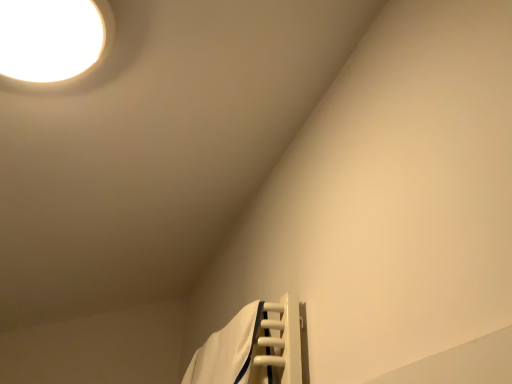
Describe the element at coordinates (227, 350) in the screenshot. I see `white fabric bath towel at lower right` at that location.

The height and width of the screenshot is (384, 512). Identify the location of white fabric bath towel at lower right. (227, 350).

What do you see at coordinates (53, 38) in the screenshot? I see `white glossy light fixture at upper left` at bounding box center [53, 38].

Measure the distance between white glossy light fixture at upper left and camera.

white glossy light fixture at upper left and camera are 28.39 inches apart from each other.

This screenshot has height=384, width=512. What are the coordinates of `white glossy light fixture at upper left` in the screenshot? It's located at (53, 38).

I want to click on white fabric bath towel at lower right, so click(227, 350).

Considering the positions of objects white fabric bath towel at lower right and white glossy light fixture at upper left in the image provided, who is more to the right, white fabric bath towel at lower right or white glossy light fixture at upper left?

From the viewer's perspective, white fabric bath towel at lower right appears more on the right side.

Is white fabric bath towel at lower right positioned in front of white glossy light fixture at upper left?

No, white fabric bath towel at lower right is behind white glossy light fixture at upper left.

Does point (252, 308) appear closer or farther from the camera than point (5, 30)?

Point (252, 308) is farther from the camera than point (5, 30).

From the image's perspective, who appears lower, white fabric bath towel at lower right or white glossy light fixture at upper left?

white fabric bath towel at lower right appears lower in the image.

From a real-world perspective, which object stands above the other?

In real-world perspective, white glossy light fixture at upper left is above.

Which object is thinner, white fabric bath towel at lower right or white glossy light fixture at upper left?

white fabric bath towel at lower right is thinner.

Can you confirm if white fabric bath towel at lower right is taller than white glossy light fixture at upper left?

Indeed, white fabric bath towel at lower right has a greater height compared to white glossy light fixture at upper left.

Based on the photo, who is bigger, white fabric bath towel at lower right or white glossy light fixture at upper left?

white glossy light fixture at upper left.

Is white fabric bath towel at lower right completely or partially outside of white glossy light fixture at upper left?

Indeed, white fabric bath towel at lower right is completely outside white glossy light fixture at upper left.

Is white fabric bath towel at lower right next to white glossy light fixture at upper left?

No, white fabric bath towel at lower right is not in contact with white glossy light fixture at upper left.

Is white fabric bath towel at lower right facing towards white glossy light fixture at upper left?

No.

Locate an element on the screen. The height and width of the screenshot is (384, 512). bath towel located on the right of white glossy light fixture at upper left is located at coordinates (227, 350).

Which is more to the left, white glossy light fixture at upper left or white fabric bath towel at lower right?

From the viewer's perspective, white glossy light fixture at upper left appears more on the left side.

Looking at this image, is the position of white glossy light fixture at upper left more distant than that of white fabric bath towel at lower right?

No, the depth of white glossy light fixture at upper left is less than that of white fabric bath towel at lower right.

Which is nearer, [27,32] or [229,328]?

The point [27,32] is more forward.

From the image's perspective, which object appears higher, white glossy light fixture at upper left or white fabric bath towel at lower right?

white glossy light fixture at upper left, from the image's perspective.

From a real-world perspective, who is located higher, white glossy light fixture at upper left or white fabric bath towel at lower right?

From a 3D spatial view, white glossy light fixture at upper left is above.

Between white glossy light fixture at upper left and white fabric bath towel at lower right, which one has larger width?

With larger width is white glossy light fixture at upper left.

Considering the relative sizes of white glossy light fixture at upper left and white fabric bath towel at lower right in the image provided, is white glossy light fixture at upper left shorter than white fabric bath towel at lower right?

Correct, white glossy light fixture at upper left is not as tall as white fabric bath towel at lower right.

Between white glossy light fixture at upper left and white fabric bath towel at lower right, which one has larger size?

white glossy light fixture at upper left is bigger.

Is white glossy light fixture at upper left outside of white fabric bath towel at lower right?

Yes, white glossy light fixture at upper left is outside of white fabric bath towel at lower right.

Is white glossy light fixture at upper left not near white fabric bath towel at lower right?

No, white glossy light fixture at upper left is in close proximity to white fabric bath towel at lower right.

Looking at this image, is white glossy light fixture at upper left turned away from white fabric bath towel at lower right?

white glossy light fixture at upper left does not have its back to white fabric bath towel at lower right.

Based on the photo, how many degrees apart are the facing directions of white glossy light fixture at upper left and white fabric bath towel at lower right?

The angle between the facing direction of white glossy light fixture at upper left and the facing direction of white fabric bath towel at lower right is 80.7 degrees.

Measure the distance from white glossy light fixture at upper left to white fabric bath towel at lower right.

31.36 inches.

Find the location of `bath towel below the white glossy light fixture at upper left (from the image's perspective)`. bath towel below the white glossy light fixture at upper left (from the image's perspective) is located at coordinates (227, 350).

The width and height of the screenshot is (512, 384). Identify the location of lamp lying above the white fabric bath towel at lower right (from the image's perspective). (53, 38).

Identify the location of bath towel below the white glossy light fixture at upper left (from a real-world perspective). pos(227,350).